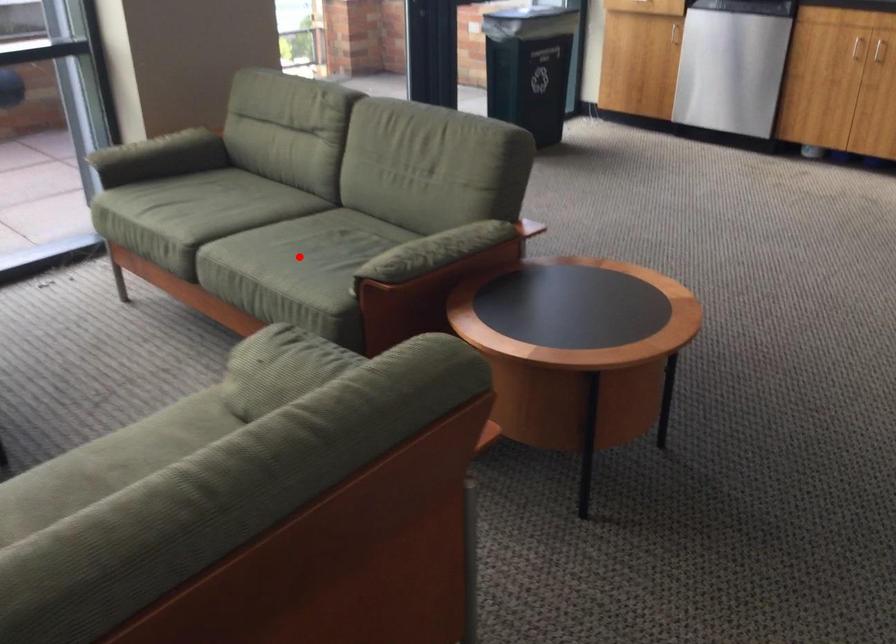
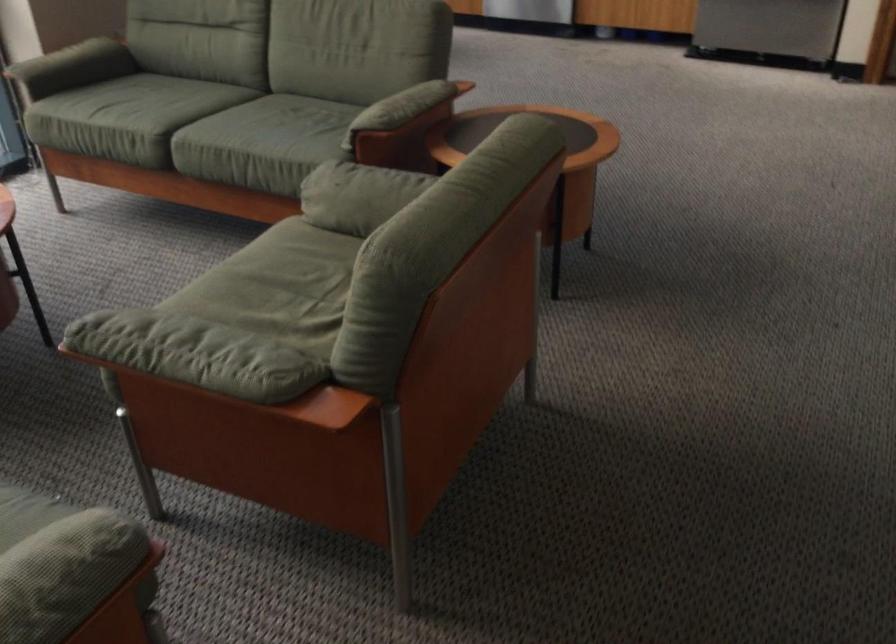
Where in the second image is the point corresponding to the highlighted location from the first image?

(271, 131)